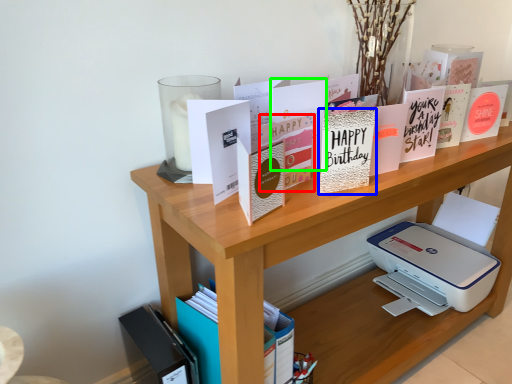
Question: Considering the real-world distances, which object is closest to paperback book (highlighted by a red box)? paperback book (highlighted by a blue box) or paperback book (highlighted by a green box).

Choices:
 (A) paperback book
 (B) paperback book

Answer: (B)